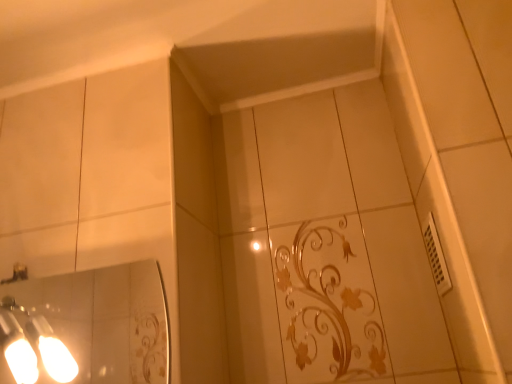
Question: Is white plastic vent at right outside of matte silver light fixture at left?

Choices:
 (A) no
 (B) yes

Answer: (B)

Question: Is white plastic vent at right to the right of matte silver light fixture at left from the viewer's perspective?

Choices:
 (A) no
 (B) yes

Answer: (B)

Question: Is there a large distance between white plastic vent at right and matte silver light fixture at left?

Choices:
 (A) no
 (B) yes

Answer: (A)

Question: Is white plastic vent at right oriented towards matte silver light fixture at left?

Choices:
 (A) no
 (B) yes

Answer: (B)

Question: Is white plastic vent at right looking in the opposite direction of matte silver light fixture at left?

Choices:
 (A) yes
 (B) no

Answer: (B)

Question: From the image's perspective, is white plastic vent at right under matte silver light fixture at left?

Choices:
 (A) no
 (B) yes

Answer: (A)

Question: Is matte silver light fixture at left behind white plastic vent at right?

Choices:
 (A) no
 (B) yes

Answer: (A)

Question: Can you confirm if matte silver light fixture at left is wider than white plastic vent at right?

Choices:
 (A) yes
 (B) no

Answer: (A)

Question: Is matte silver light fixture at left next to white plastic vent at right and touching it?

Choices:
 (A) no
 (B) yes

Answer: (A)

Question: Considering the relative sizes of matte silver light fixture at left and white plastic vent at right in the image provided, is matte silver light fixture at left shorter than white plastic vent at right?

Choices:
 (A) no
 (B) yes

Answer: (A)

Question: Is matte silver light fixture at left far from white plastic vent at right?

Choices:
 (A) no
 (B) yes

Answer: (A)

Question: Does matte silver light fixture at left have a greater height compared to white plastic vent at right?

Choices:
 (A) no
 (B) yes

Answer: (B)

Question: From the image's perspective, is matte silver light fixture at left located above or below white plastic vent at right?

Choices:
 (A) above
 (B) below

Answer: (B)